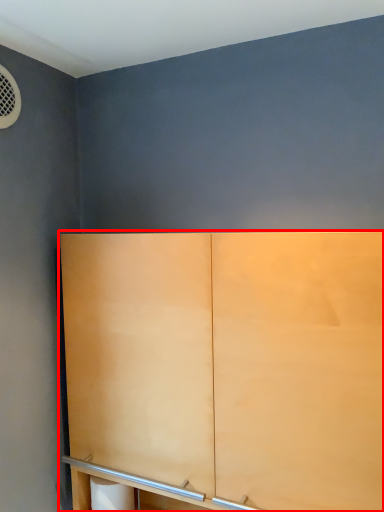
Question: From the image's perspective, considering the relative positions of cupboard (annotated by the red box) and toilet paper in the image provided, where is cupboard (annotated by the red box) located with respect to the staircase?

Choices:
 (A) below
 (B) above

Answer: (B)